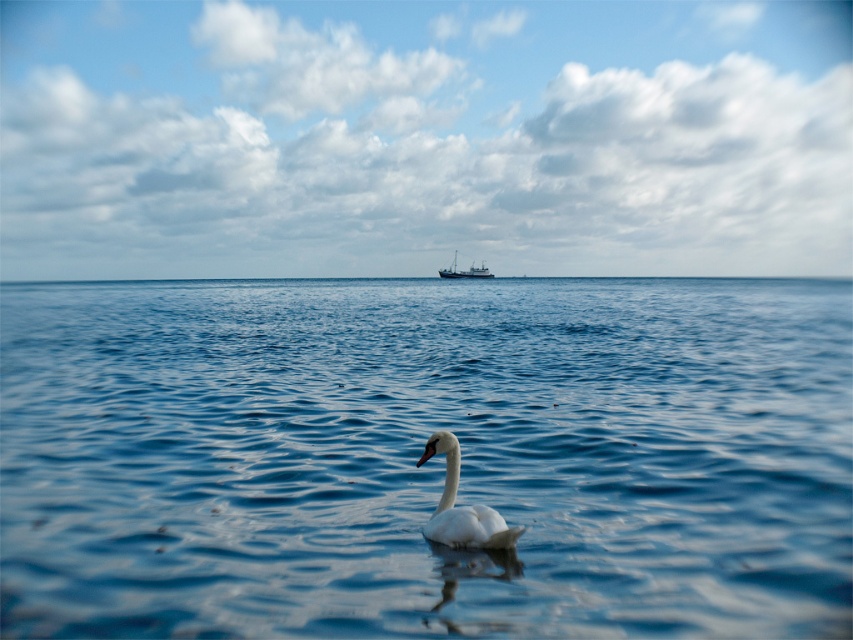
Who is higher up, blue water at center or white glossy swan at center?

blue water at center

Is point (19, 320) positioned after point (498, 544)?

Yes, point (19, 320) is farther from viewer.

Is point (495, 600) in front of point (422, 531)?

Yes, it is.

Image resolution: width=853 pixels, height=640 pixels. Identify the location of blue water at center. (428, 460).

Does blue water at center have a larger size compared to white matte boat at center?

Yes.

Between point (401, 461) and point (469, 268), which one is positioned behind?

The point (469, 268) is more distant.

Describe the element at coordinates (428, 460) in the screenshot. I see `blue water at center` at that location.

Where is `blue water at center`? This screenshot has height=640, width=853. blue water at center is located at coordinates (428, 460).

Is white glossy swan at center shorter than white matte boat at center?

Correct, white glossy swan at center is not as tall as white matte boat at center.

Between white glossy swan at center and white matte boat at center, which one appears on the left side from the viewer's perspective?

white glossy swan at center is more to the left.

Does point (427, 528) come closer to viewer compared to point (489, 276)?

Yes, point (427, 528) is closer to viewer.

What are the coordinates of `white glossy swan at center` in the screenshot? It's located at (462, 508).